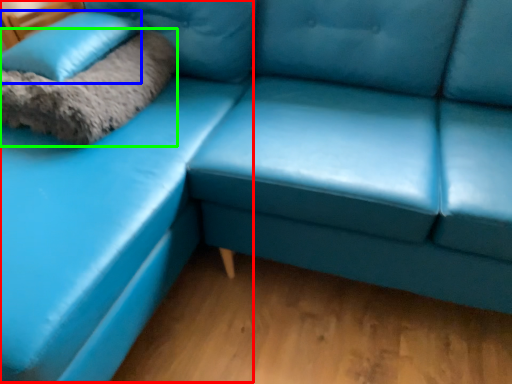
Question: Estimate the real-world distances between objects in this image. Which object is farther from couch (highlighted by a red box), pillow (highlighted by a blue box) or blanket (highlighted by a green box)?

Choices:
 (A) pillow
 (B) blanket

Answer: (A)